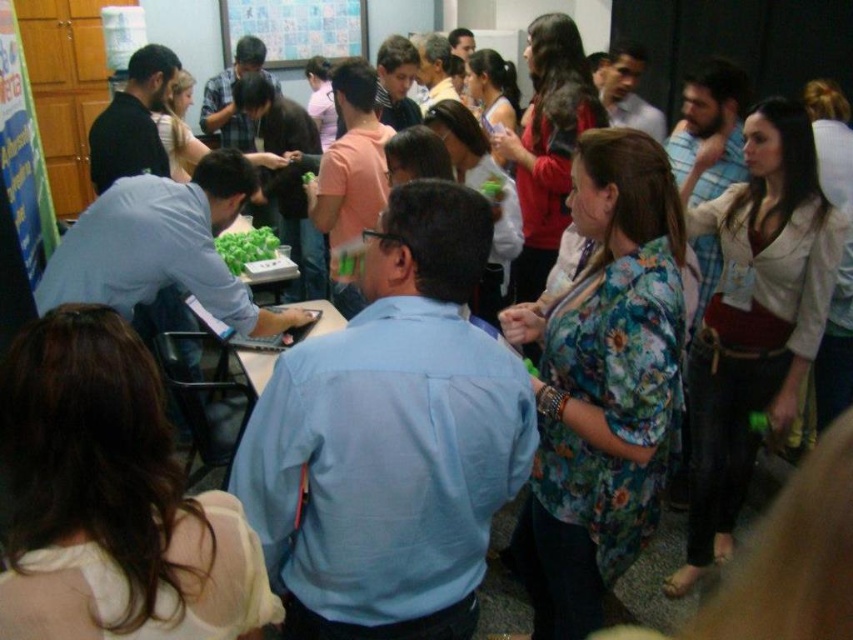
Question: Is white paperboard at upper center further to camera compared to green leafy vegetables at center?

Choices:
 (A) yes
 (B) no

Answer: (A)

Question: Which of the following is the farthest from the observer?

Choices:
 (A) (328, 45)
 (B) (273, 244)

Answer: (A)

Question: From the image, what is the correct spatial relationship of floral fabric blouse at right in relation to white paperboard at upper center?

Choices:
 (A) above
 (B) below

Answer: (B)

Question: Which object is farther from the camera taking this photo?

Choices:
 (A) floral fabric blouse at right
 (B) green leafy vegetables at center

Answer: (B)

Question: Which of the following is the closest to the observer?

Choices:
 (A) (230, 36)
 (B) (782, 385)

Answer: (B)

Question: Does white paperboard at upper center have a greater width compared to green leafy vegetables at center?

Choices:
 (A) yes
 (B) no

Answer: (A)